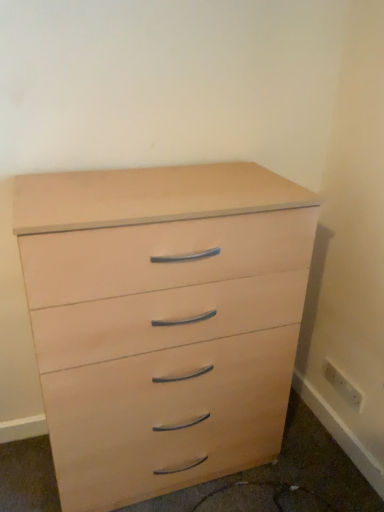
Question: Which direction should I rotate to look at light wood/veneer chest of drawers at center?

Choices:
 (A) left
 (B) right

Answer: (A)

Question: Does light wood/veneer chest of drawers at center appear on the right side of white plastic electric outlet at lower right?

Choices:
 (A) no
 (B) yes

Answer: (A)

Question: Can you confirm if light wood/veneer chest of drawers at center is shorter than white plastic electric outlet at lower right?

Choices:
 (A) yes
 (B) no

Answer: (B)

Question: From the image's perspective, is light wood/veneer chest of drawers at center on top of white plastic electric outlet at lower right?

Choices:
 (A) yes
 (B) no

Answer: (A)

Question: Is light wood/veneer chest of drawers at center far away from white plastic electric outlet at lower right?

Choices:
 (A) no
 (B) yes

Answer: (A)

Question: Is light wood/veneer chest of drawers at center surrounding white plastic electric outlet at lower right?

Choices:
 (A) no
 (B) yes

Answer: (A)

Question: Is light wood/veneer chest of drawers at center not inside white plastic electric outlet at lower right?

Choices:
 (A) yes
 (B) no

Answer: (A)

Question: Considering the relative sizes of white plastic electric outlet at lower right and light wood/veneer chest of drawers at center in the image provided, is white plastic electric outlet at lower right bigger than light wood/veneer chest of drawers at center?

Choices:
 (A) no
 (B) yes

Answer: (A)

Question: Considering the relative sizes of white plastic electric outlet at lower right and light wood/veneer chest of drawers at center in the image provided, is white plastic electric outlet at lower right shorter than light wood/veneer chest of drawers at center?

Choices:
 (A) no
 (B) yes

Answer: (B)

Question: From a real-world perspective, is white plastic electric outlet at lower right on top of light wood/veneer chest of drawers at center?

Choices:
 (A) yes
 (B) no

Answer: (B)

Question: From the image's perspective, would you say white plastic electric outlet at lower right is positioned over light wood/veneer chest of drawers at center?

Choices:
 (A) no
 (B) yes

Answer: (A)

Question: Is white plastic electric outlet at lower right aimed at light wood/veneer chest of drawers at center?

Choices:
 (A) yes
 (B) no

Answer: (A)

Question: Is white plastic electric outlet at lower right positioned with its back to light wood/veneer chest of drawers at center?

Choices:
 (A) no
 (B) yes

Answer: (A)

Question: Is light wood drawer at lower right positioned before white plastic electric outlet at lower right?

Choices:
 (A) yes
 (B) no

Answer: (A)